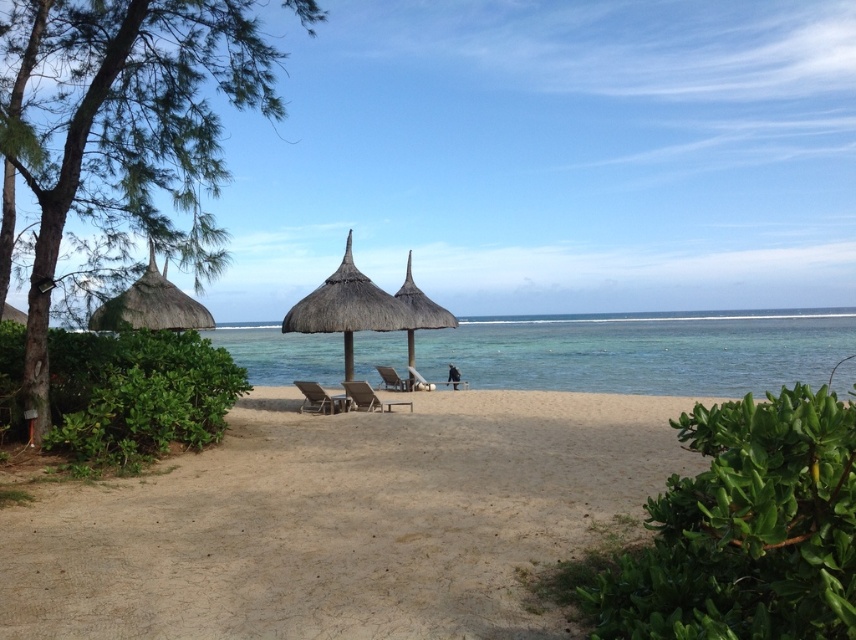
You are standing at the center of the sandy path leading to the beach and see a thatched straw umbrella at center. Where is the point with coordinates point (348, 307) located?

The point with coordinates point (348, 307) is located on the thatched straw umbrella at center.

You are planning to set up a small picnic area on the beach. You have a picnic blanket that can cover an area larger than the natural thatch umbrella at center. Based on the scene description, will your picnic blanket be large enough to also cover the clear blue water at center?

The clear blue water at center is bigger than the natural thatch umbrella at center. Since your picnic blanket can cover an area larger than the natural thatch umbrella at center, it may still not be large enough to cover the clear blue water at center, as the water is larger in size.

You are planning to set up a picnic spot on the beach. You have two options for shade provided by the thatched straw hut at left and the natural thatch umbrella at center. Based on their positions, which one would you choose if you want your picnic area to be closer to the beach path?

The natural thatch umbrella at center is positioned closer to the beach path than the thatched straw hut at left, so you should choose the natural thatch umbrella at center for your picnic area.